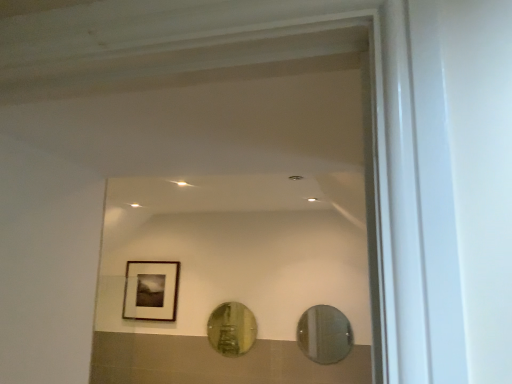
Question: Which direction should I rotate to look at gold reflective mirror at center, which is the second mirror from front to back?

Choices:
 (A) left
 (B) right

Answer: (A)

Question: Is clear glass mirror at center, the 1th mirror from the right, in front of matte black frame at upper left?

Choices:
 (A) no
 (B) yes

Answer: (B)

Question: Is clear glass mirror at center, the 2th mirror in the left-to-right sequence, facing towards matte black frame at upper left?

Choices:
 (A) yes
 (B) no

Answer: (B)

Question: Is clear glass mirror at center, marked as the second mirror in a back-to-front arrangement, thinner than matte black frame at upper left?

Choices:
 (A) yes
 (B) no

Answer: (A)

Question: Is clear glass mirror at center, marked as the second mirror in a back-to-front arrangement, outside matte black frame at upper left?

Choices:
 (A) no
 (B) yes

Answer: (B)

Question: Is the surface of clear glass mirror at center, the 1th mirror from the right, in direct contact with matte black frame at upper left?

Choices:
 (A) no
 (B) yes

Answer: (A)

Question: Is clear glass mirror at center, the 1th mirror from the right, to the right of matte black frame at upper left from the viewer's perspective?

Choices:
 (A) yes
 (B) no

Answer: (A)

Question: From the image's perspective, is matte black frame at upper left on clear glass mirror at center, the first mirror in the front-to-back sequence?

Choices:
 (A) no
 (B) yes

Answer: (B)

Question: Is matte black frame at upper left beside clear glass mirror at center, the first mirror in the front-to-back sequence?

Choices:
 (A) yes
 (B) no

Answer: (B)

Question: Does matte black frame at upper left come in front of clear glass mirror at center, the 2th mirror in the left-to-right sequence?

Choices:
 (A) no
 (B) yes

Answer: (A)

Question: Is matte black frame at upper left far from clear glass mirror at center, the 1th mirror from the right?

Choices:
 (A) yes
 (B) no

Answer: (A)

Question: Considering the relative sizes of matte black frame at upper left and clear glass mirror at center, marked as the second mirror in a back-to-front arrangement, in the image provided, is matte black frame at upper left smaller than clear glass mirror at center, marked as the second mirror in a back-to-front arrangement,?

Choices:
 (A) no
 (B) yes

Answer: (A)

Question: From a real-world perspective, is matte black frame at upper left over clear glass mirror at center, the 2th mirror in the left-to-right sequence?

Choices:
 (A) no
 (B) yes

Answer: (B)

Question: Does clear glass mirror at center, the 2th mirror in the left-to-right sequence, have a greater height compared to gold reflective mirror at center, which is the second mirror from front to back?

Choices:
 (A) no
 (B) yes

Answer: (A)